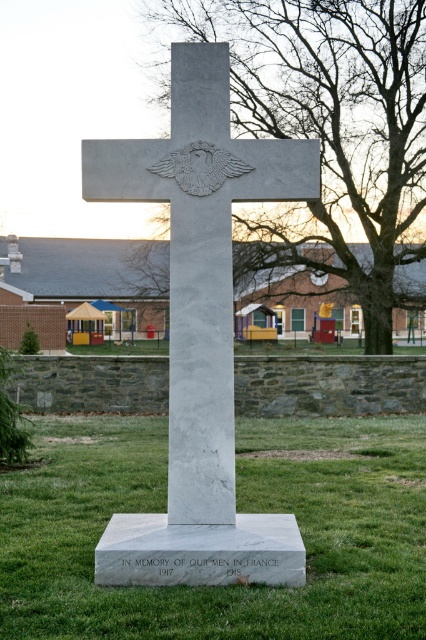
Question: Can you confirm if green grass at center is positioned to the right of white marble cross at center?

Choices:
 (A) yes
 (B) no

Answer: (B)

Question: Does green grass at center have a smaller size compared to white marble cross at center?

Choices:
 (A) no
 (B) yes

Answer: (A)

Question: Which point is closer to the camera?

Choices:
 (A) (141, 141)
 (B) (77, 554)

Answer: (A)

Question: Which object appears farthest from the camera in this image?

Choices:
 (A) white marble cross at center
 (B) green grass at center

Answer: (A)

Question: Is green grass at center to the left of white marble cross at center from the viewer's perspective?

Choices:
 (A) yes
 (B) no

Answer: (A)